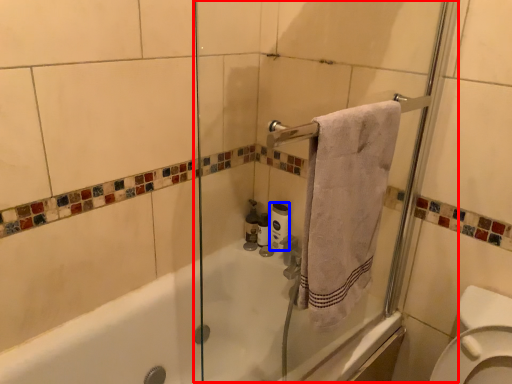
Question: Which of the following is the closest to the observer, screen door (highlighted by a red box) or toilet paper (highlighted by a blue box)?

Choices:
 (A) screen door
 (B) toilet paper

Answer: (A)